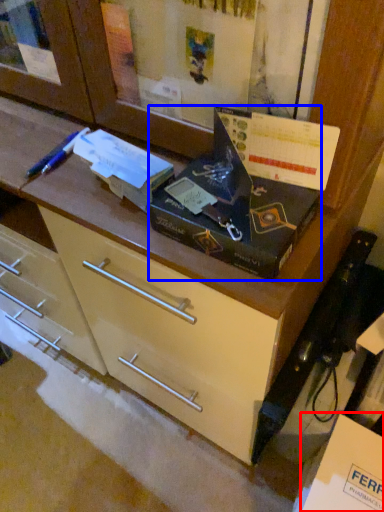
Question: Which of the following is the farthest to the observer, cardboard box (highlighted by a red box) or box (highlighted by a blue box)?

Choices:
 (A) cardboard box
 (B) box

Answer: (A)